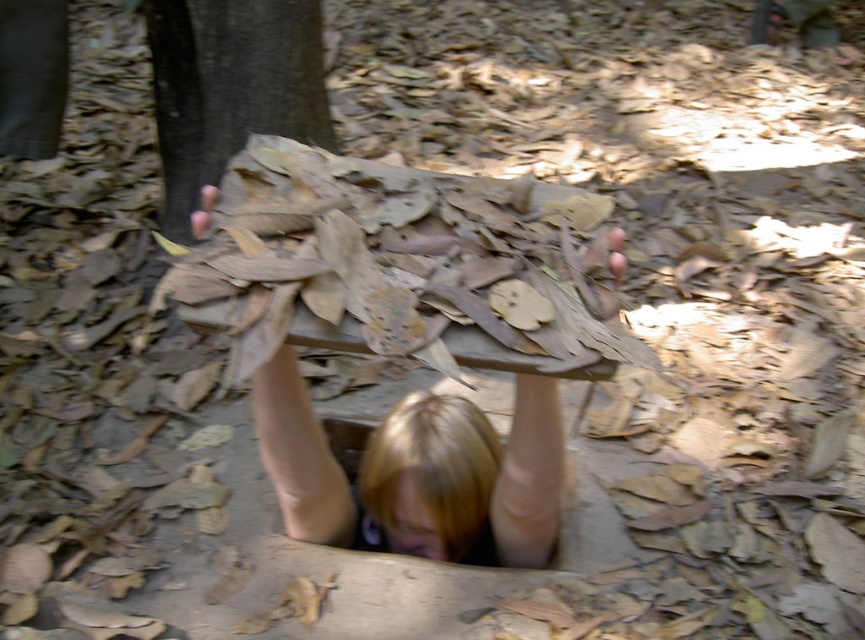
Find the location of a particular element. This screenshot has height=640, width=865. brown rough tree trunk at upper left is located at coordinates (229, 88).

Can you confirm if brown rough tree trunk at upper left is wider than blonde hair at center?

No.

Who is more forward, (274, 128) or (292, 410)?

Point (292, 410)

Image resolution: width=865 pixels, height=640 pixels. I want to click on brown rough tree trunk at upper left, so click(x=229, y=88).